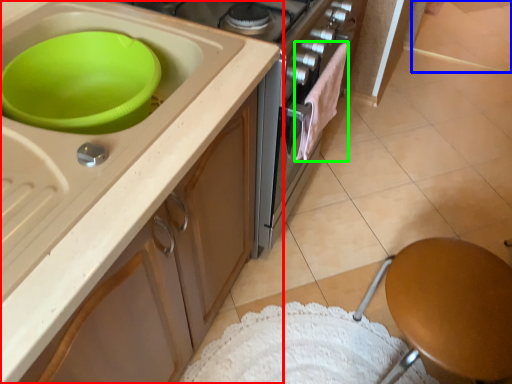
Question: Based on their relative distances, which object is nearer to cabinetry (highlighted by a red box)? Choose from tile (highlighted by a blue box) and clothe (highlighted by a green box).

Choices:
 (A) tile
 (B) clothe

Answer: (B)